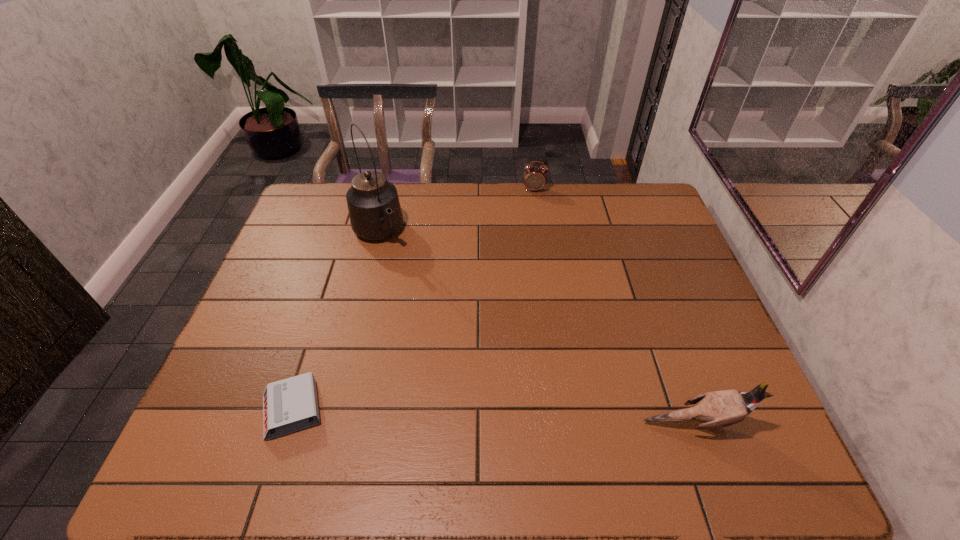
Where is `vacant point located between the bird and the nearer alarm clock`? vacant point located between the bird and the nearer alarm clock is located at coordinates (493, 416).

Find the location of a particular element. This screenshot has height=540, width=960. unoccupied position between the shorter alarm clock and the third shortest object is located at coordinates (493, 416).

Locate an element on the screen. The height and width of the screenshot is (540, 960). unoccupied area between the nearer alarm clock and the third nearest object is located at coordinates (335, 321).

Locate an element on the screen. vacant area between the bird and the shortest object is located at coordinates (493, 416).

Where is `vacant area that lies between the left alarm clock and the rightmost object`? The image size is (960, 540). vacant area that lies between the left alarm clock and the rightmost object is located at coordinates (493, 416).

At what (x,y) coordinates should I click in order to perform the action: click on free space between the third nearest object and the shorter alarm clock. Please return your answer as a coordinate pair (x, y). Looking at the image, I should click on coord(335,321).

This screenshot has height=540, width=960. Find the location of `unoccupied position between the nearer alarm clock and the farthest object`. unoccupied position between the nearer alarm clock and the farthest object is located at coordinates (413, 300).

This screenshot has height=540, width=960. I want to click on blank region between the second tallest object and the kettle, so click(x=537, y=328).

This screenshot has width=960, height=540. Identify the location of vacant area that lies between the kettle and the second object from right to left. pos(456,211).

Locate an element on the screen. the closest object relative to the third shortest object is located at coordinates (289, 405).